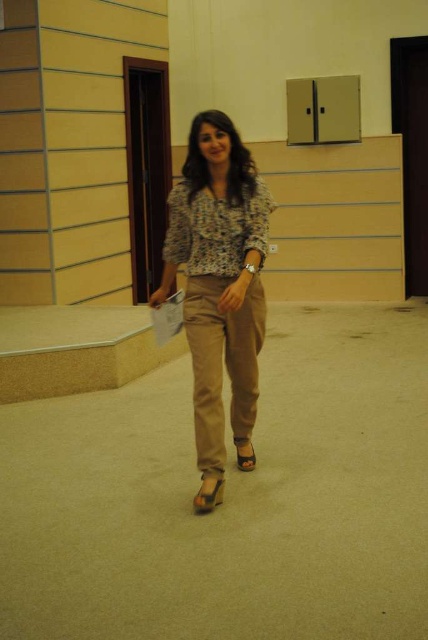
Between matte floral blouse at center and tan cotton pants at center, which one is positioned lower?

tan cotton pants at center

This screenshot has width=428, height=640. What do you see at coordinates (219, 278) in the screenshot?
I see `matte floral blouse at center` at bounding box center [219, 278].

Locate an element on the screen. The width and height of the screenshot is (428, 640). matte floral blouse at center is located at coordinates (219, 278).

How far apart are matte floral blouse at center and floral print blouse at center?

matte floral blouse at center and floral print blouse at center are 22.66 centimeters apart.

Between matte floral blouse at center and floral print blouse at center, which one has less height?

floral print blouse at center is shorter.

Who is more distant from viewer, (175, 232) or (190, 216)?

The point (175, 232) is more distant.

Locate an element on the screen. The width and height of the screenshot is (428, 640). matte floral blouse at center is located at coordinates (219, 278).

Looking at this image, does floral print blouse at center have a lesser height compared to brown suede sandal at lower center?

In fact, floral print blouse at center may be taller than brown suede sandal at lower center.

Is floral print blouse at center to the left of brown suede sandal at lower center from the viewer's perspective?

Indeed, floral print blouse at center is positioned on the left side of brown suede sandal at lower center.

Describe the element at coordinates (216, 228) in the screenshot. This screenshot has height=640, width=428. I see `floral print blouse at center` at that location.

Where is `floral print blouse at center`? floral print blouse at center is located at coordinates (216, 228).